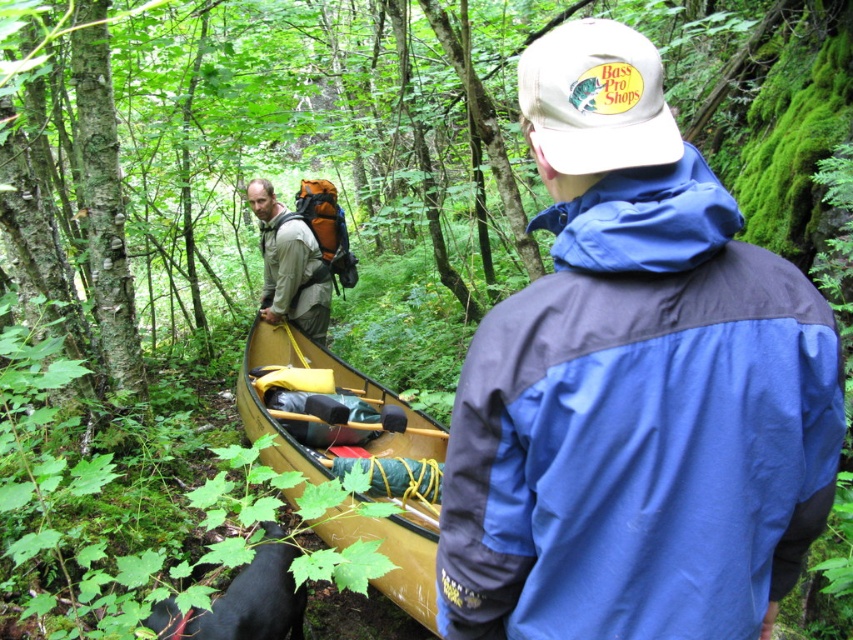
Who is higher up, matte orange backpack at center or wooden paddle at center?

matte orange backpack at center is above.

Consider the image. Who is shorter, matte orange backpack at center or wooden paddle at center?

Standing shorter between the two is wooden paddle at center.

I want to click on matte orange backpack at center, so click(x=289, y=266).

Find the location of `matte orange backpack at center`. matte orange backpack at center is located at coordinates (289, 266).

Is wooden paddle at center bigger than yellow plastic paddle at center?

Yes, wooden paddle at center is bigger than yellow plastic paddle at center.

Is wooden paddle at center taller than yellow plastic paddle at center?

Incorrect, wooden paddle at center's height is not larger of yellow plastic paddle at center's.

The image size is (853, 640). What are the coordinates of `wooden paddle at center` in the screenshot? It's located at (294, 416).

The width and height of the screenshot is (853, 640). In order to click on wooden canoe at center in this screenshot , I will do `click(351, 454)`.

Who is higher up, wooden canoe at center or wooden paddle at center?

Positioned higher is wooden canoe at center.

Find the location of a particular element. wooden canoe at center is located at coordinates (351, 454).